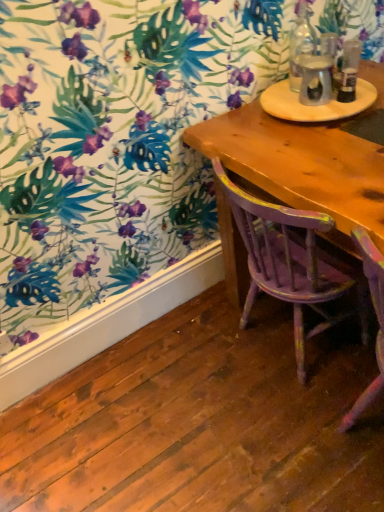
Where is `free space in front of clear glass bottle at upper right, the 2th bottle from the right`? The height and width of the screenshot is (512, 384). free space in front of clear glass bottle at upper right, the 2th bottle from the right is located at coordinates (307, 110).